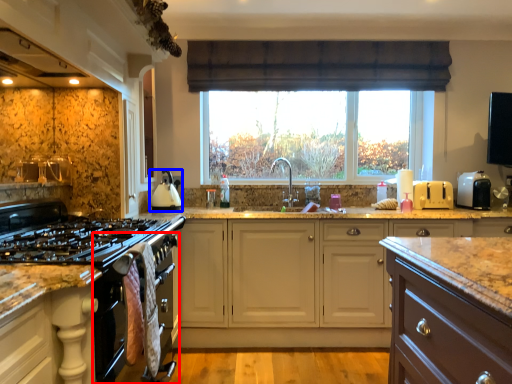
Question: Which of the following is the closest to the observer, oven (highlighted by a red box) or kitchen appliance (highlighted by a blue box)?

Choices:
 (A) oven
 (B) kitchen appliance

Answer: (A)